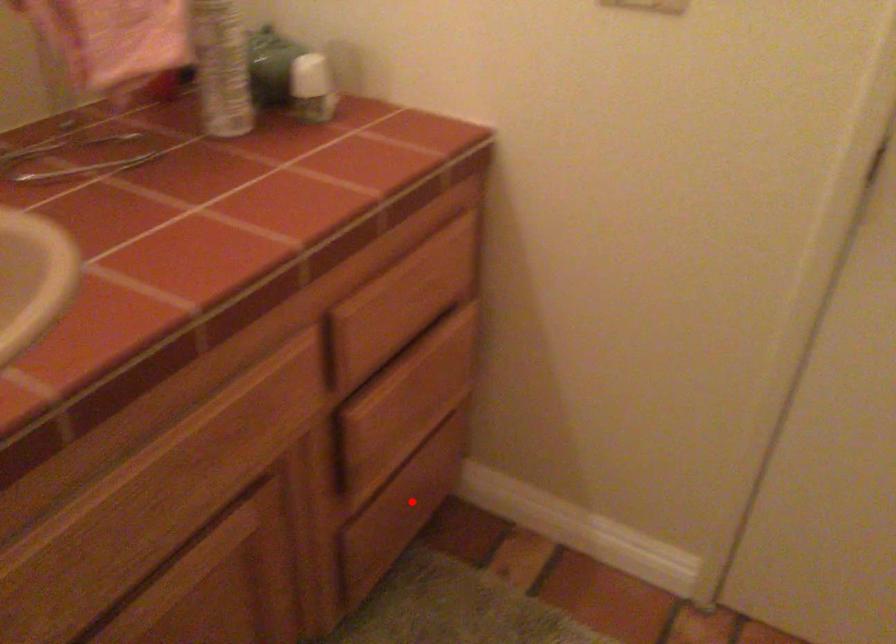
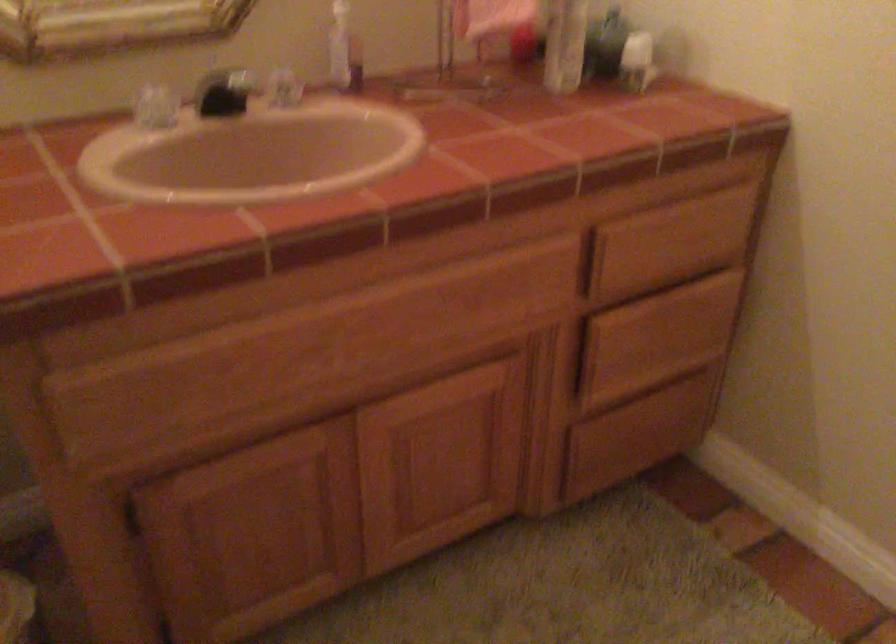
Question: I am providing you with two images of the same scene from different viewpoints. A red point is shown in image1. For the corresponding object point in image2, is it positioned nearer or farther from the camera?

Choices:
 (A) Nearer
 (B) Farther

Answer: (B)